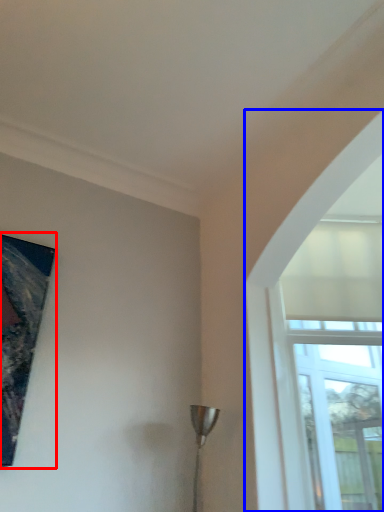
Question: Which of the following is the farthest to the observer, picture frame (highlighted by a red box) or window (highlighted by a blue box)?

Choices:
 (A) picture frame
 (B) window

Answer: (B)